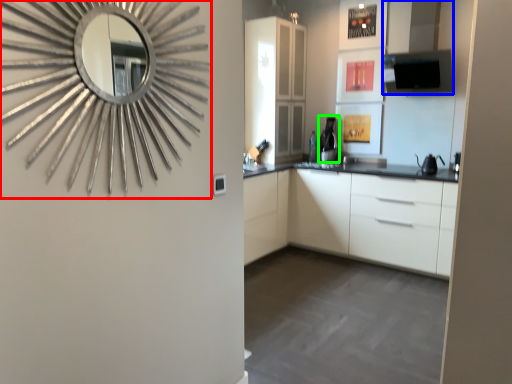
Question: Which object is the closest to the mirror (highlighted by a red box)? Choose among these: exhaust hood (highlighted by a blue box) or coffee machine (highlighted by a green box).

Choices:
 (A) exhaust hood
 (B) coffee machine

Answer: (A)